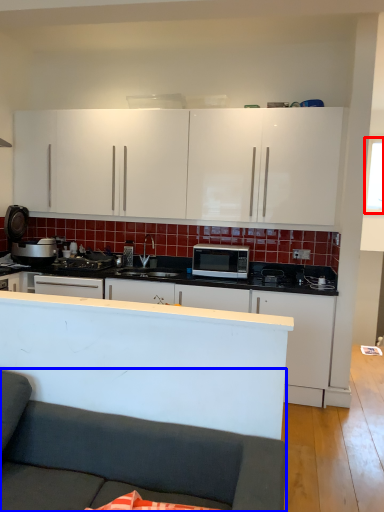
Question: Which object appears closest to the camera in this image, window screen (highlighted by a red box) or studio couch (highlighted by a blue box)?

Choices:
 (A) window screen
 (B) studio couch

Answer: (B)